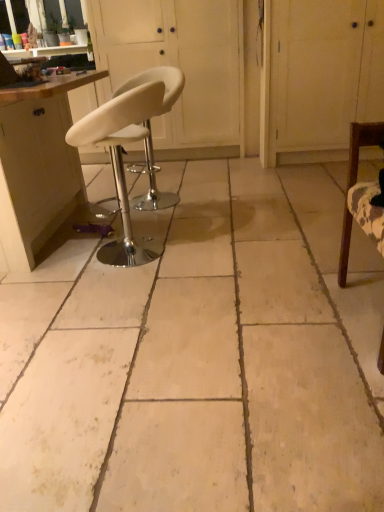
The width and height of the screenshot is (384, 512). I want to click on vacant space that is to the left of white leather stool at center, arranged as the 2th chair when viewed from the back, so click(58, 265).